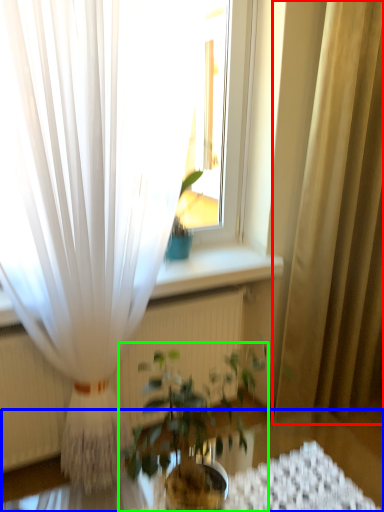
Question: Based on their relative distances, which object is nearer to curtain (highlighted by a red box)? Choose from round table (highlighted by a blue box) and houseplant (highlighted by a green box).

Choices:
 (A) round table
 (B) houseplant

Answer: (A)